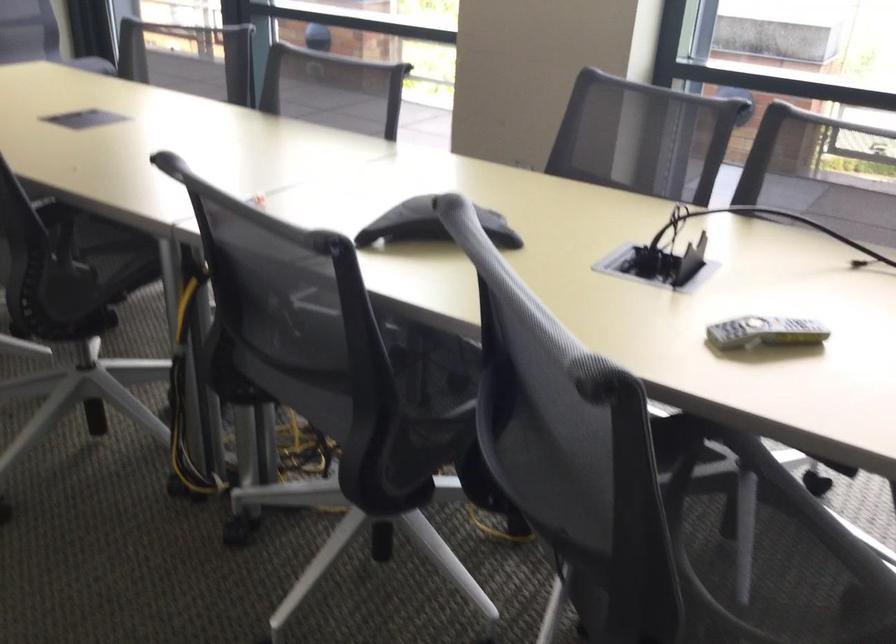
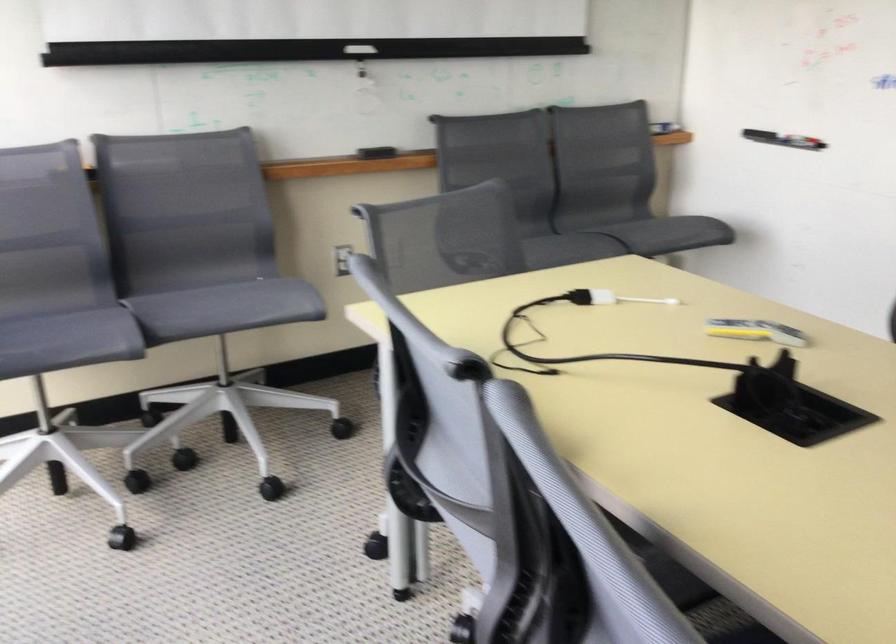
Find the pixel in the second image that matches pixel 748 339 in the first image.

(755, 330)